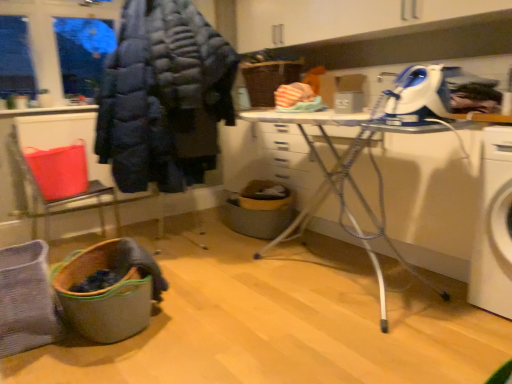
At what (x,y) coordinates should I click in order to perform the action: click on free space to the right of wooden laundry basket at lower left. Please return your answer as a coordinate pair (x, y). Looking at the image, I should click on (213, 309).